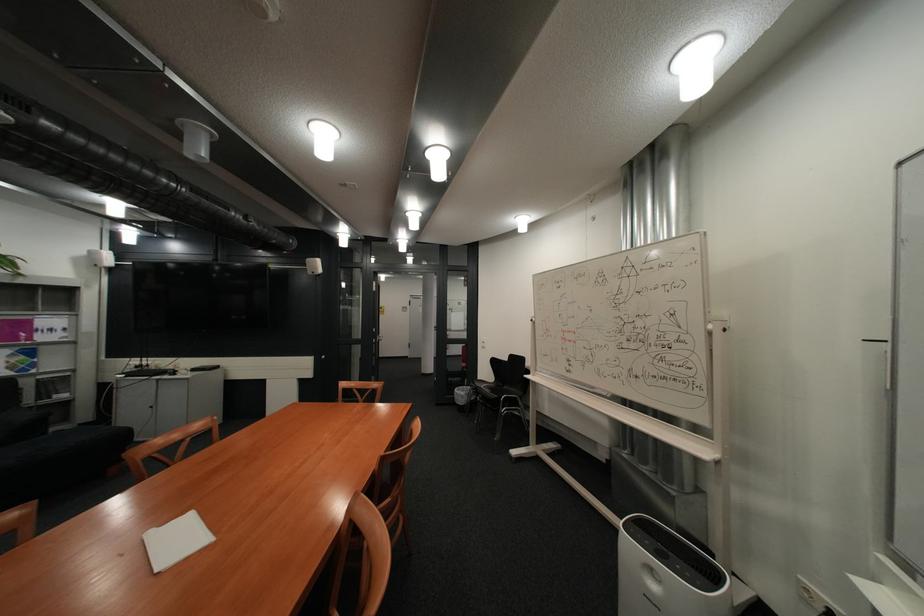
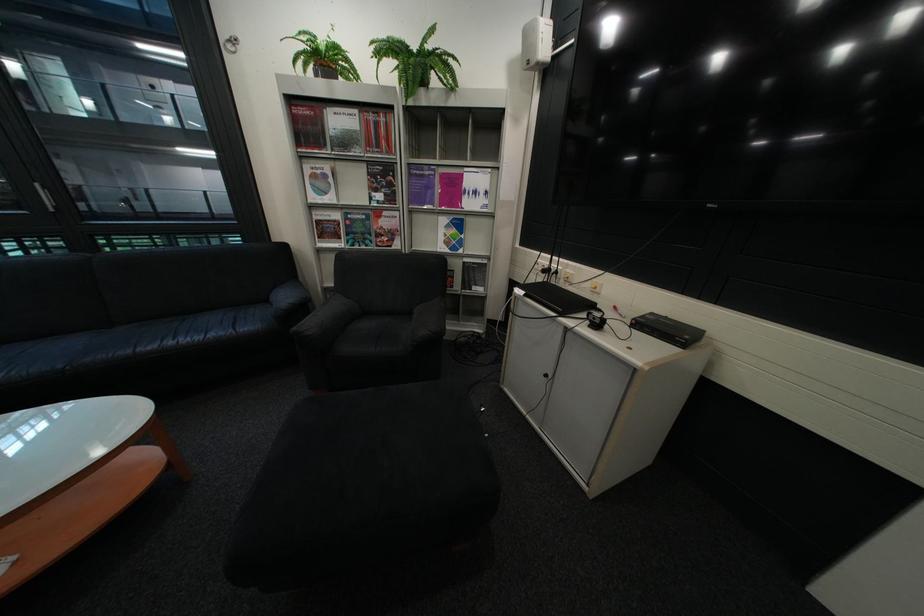
Locate, in the second image, the point that corresponds to [59,338] in the first image.

(484, 204)